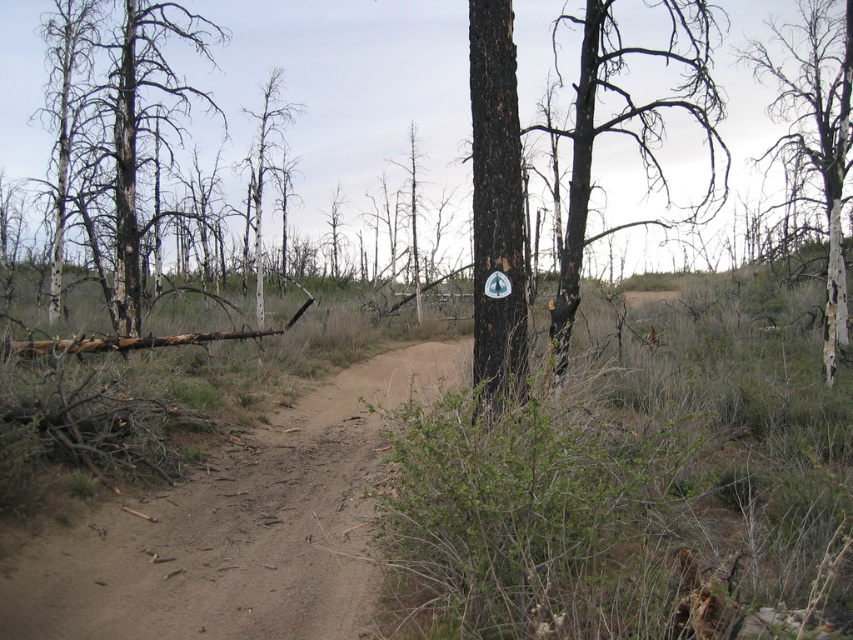
Question: Which point is closer to the camera?

Choices:
 (A) dead wood tree at center
 (B) black bark tree at center
 (C) charred bark tree at upper right
 (D) dirt path at center

Answer: (D)

Question: Is dirt path at center positioned at the back of charred bark tree at upper right?

Choices:
 (A) yes
 (B) no

Answer: (B)

Question: Is black bark tree at center to the left of dead wood tree at center from the viewer's perspective?

Choices:
 (A) yes
 (B) no

Answer: (B)

Question: Considering the real-world distances, which object is farthest from the dirt path at center?

Choices:
 (A) dead wood tree at center
 (B) charred wood tree at left
 (C) charred bark tree at upper right

Answer: (C)

Question: Does charred bark tree at upper right have a lesser width compared to dead wood tree at center?

Choices:
 (A) yes
 (B) no

Answer: (B)

Question: Which point is farther from the camera taking this photo?

Choices:
 (A) (9, 577)
 (B) (833, 298)
 (C) (492, 401)

Answer: (B)